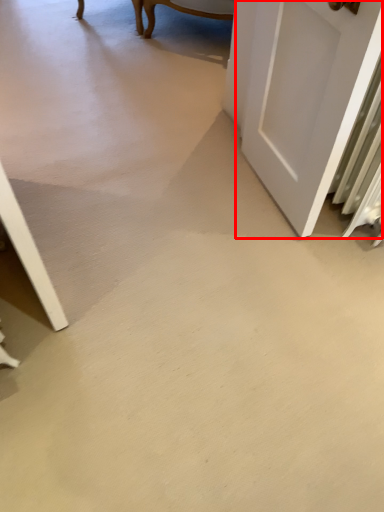
Question: From the image's perspective, where is door (annotated by the red box) located relative to concrete?

Choices:
 (A) above
 (B) below

Answer: (A)